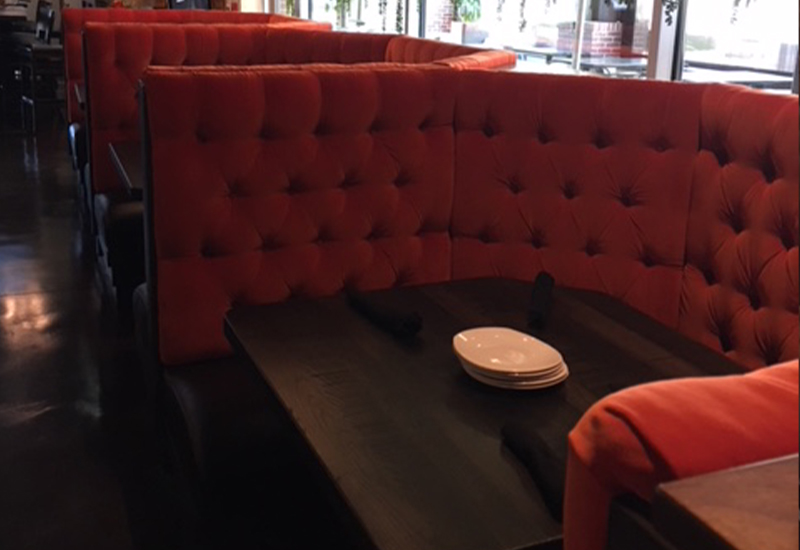
Locate an element on the screen. Image resolution: width=800 pixels, height=550 pixels. chair is located at coordinates (40, 82).